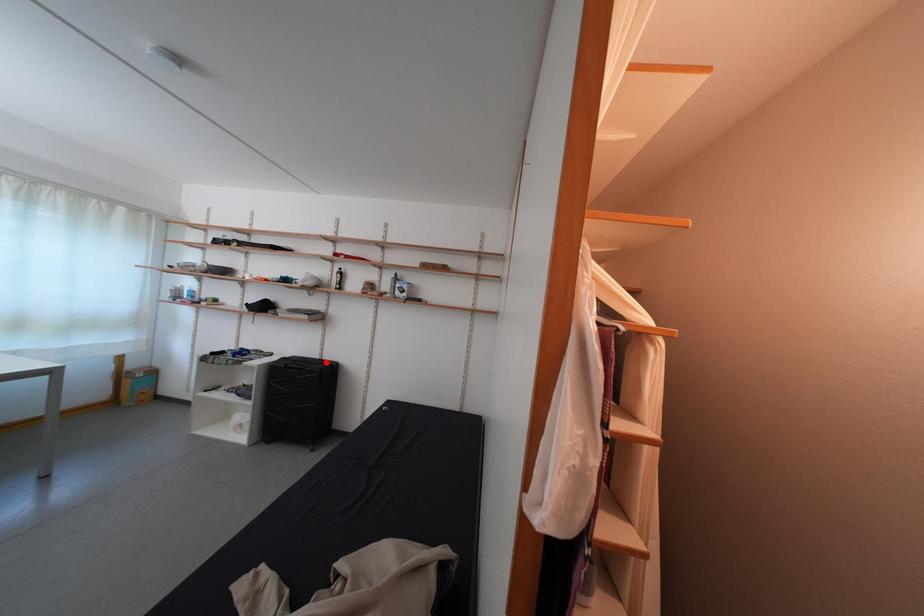
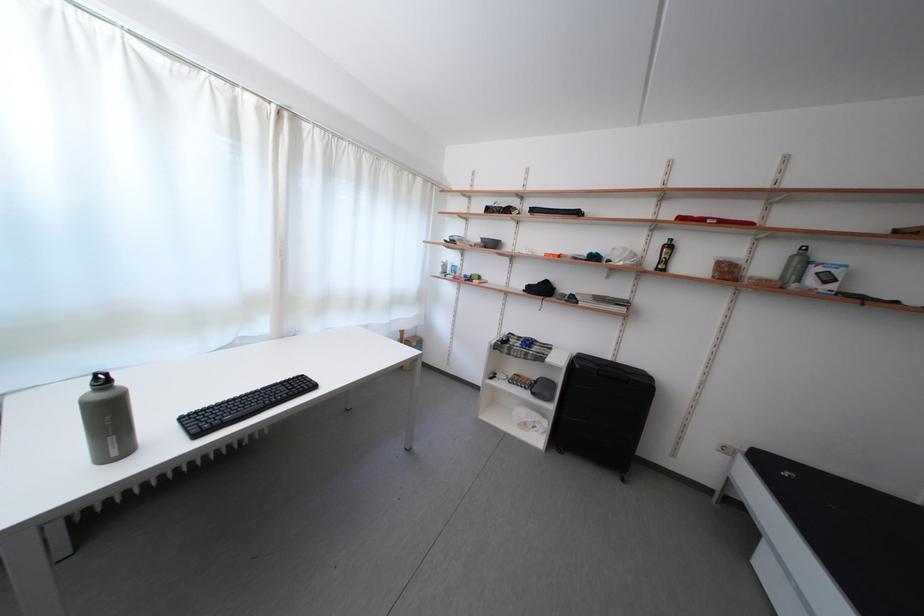
Find the pixel in the second image that matches the highlighted location in the first image.

(617, 363)